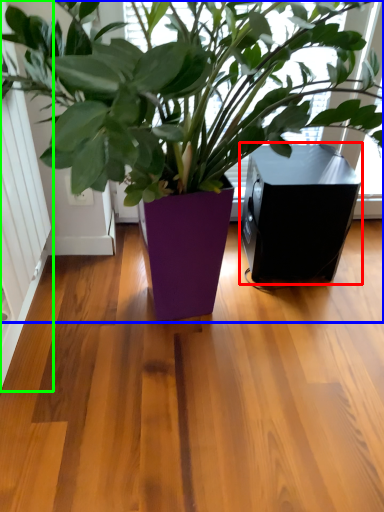
Question: Considering the real-world distances, which object is farthest from speaker (highlighted by a red box)? houseplant (highlighted by a blue box) or screen door (highlighted by a green box)?

Choices:
 (A) houseplant
 (B) screen door

Answer: (B)